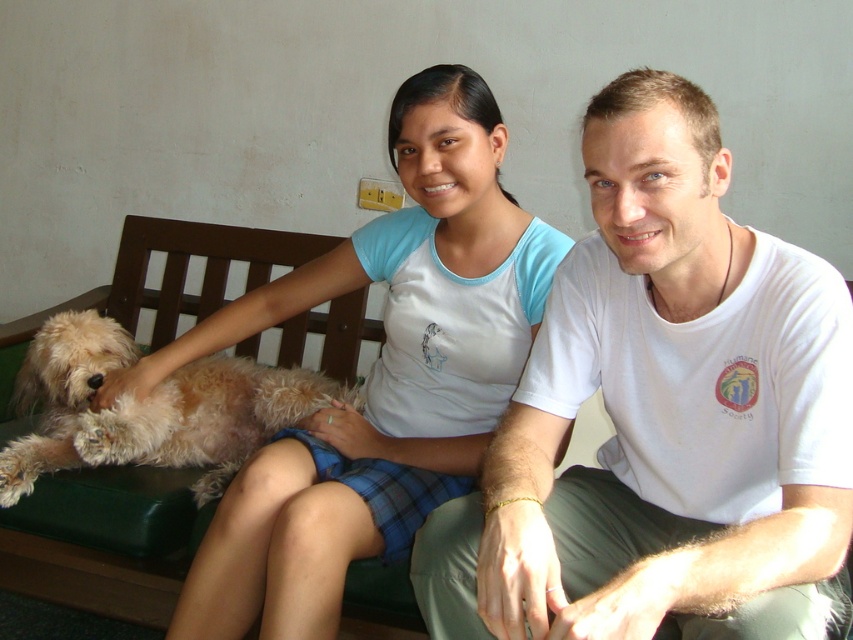
Question: From the image, what is the correct spatial relationship of white cotton t-shirt at center in relation to light blue fabric shirt at center?

Choices:
 (A) above
 (B) below

Answer: (B)

Question: Does white cotton t-shirt at center have a smaller size compared to light blue fabric shirt at center?

Choices:
 (A) no
 (B) yes

Answer: (B)

Question: Among these objects, which one is farthest from the camera?

Choices:
 (A) light blue fabric shirt at center
 (B) white cotton t-shirt at center
 (C) fuzzy brown dog at lower left

Answer: (C)

Question: Can you confirm if light blue fabric shirt at center is bigger than fuzzy brown dog at lower left?

Choices:
 (A) yes
 (B) no

Answer: (A)

Question: Considering the real-world distances, which object is farthest from the light blue fabric shirt at center?

Choices:
 (A) fuzzy brown dog at lower left
 (B) white cotton t-shirt at center

Answer: (B)

Question: Which point is closer to the camera?

Choices:
 (A) (466, 74)
 (B) (796, 516)

Answer: (B)